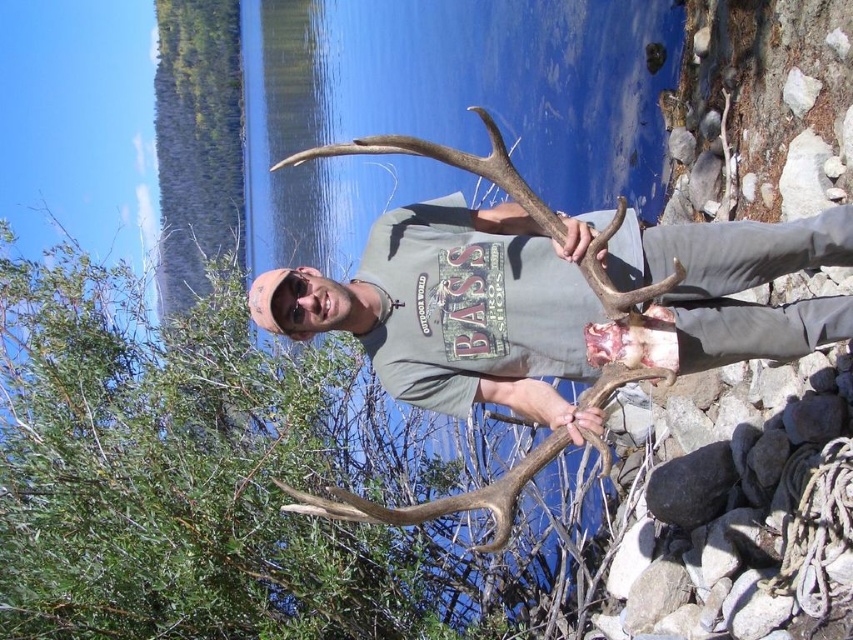
Question: Among these points, which one is nearest to the camera?

Choices:
 (A) (163, 621)
 (B) (358, 339)

Answer: (B)

Question: Can you confirm if green leafy bush at center is positioned to the right of gray matte t-shirt at center?

Choices:
 (A) yes
 (B) no

Answer: (B)

Question: Which of the following is the farthest from the observer?

Choices:
 (A) gray matte t-shirt at center
 (B) green leafy bush at center

Answer: (B)

Question: Which of the following is the closest to the observer?

Choices:
 (A) (838, 324)
 (B) (173, 394)

Answer: (A)

Question: Observing the image, what is the correct spatial positioning of green leafy bush at center in reference to gray matte t-shirt at center?

Choices:
 (A) below
 (B) above

Answer: (A)

Question: Is green leafy bush at center bigger than gray matte t-shirt at center?

Choices:
 (A) no
 (B) yes

Answer: (B)